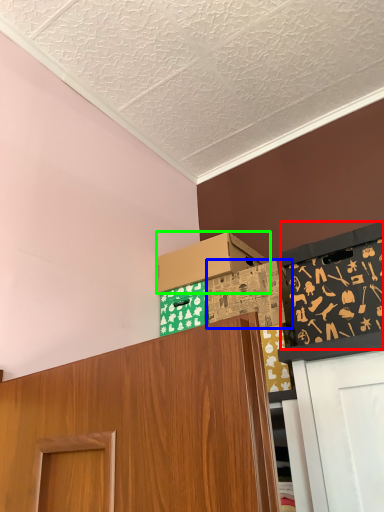
Question: Which is farther away from bulletin board (highlighted by a red box)? box (highlighted by a blue box) or box (highlighted by a green box)?

Choices:
 (A) box
 (B) box

Answer: (B)